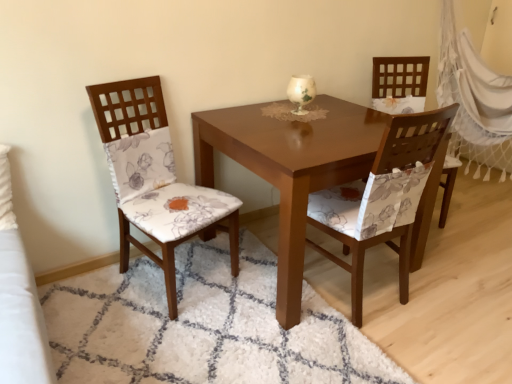
The width and height of the screenshot is (512, 384). What are the coordinates of `space that is in front of floral fabric chair at right, which is the 1th chair from right to left` in the screenshot? It's located at (456, 254).